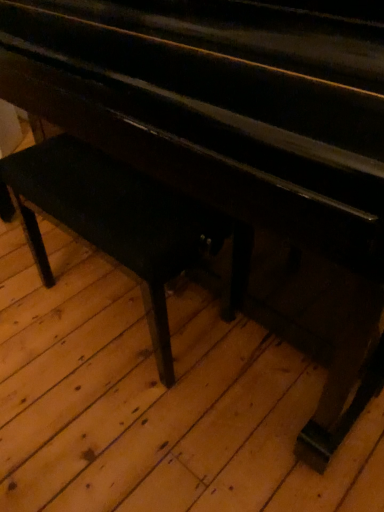
In order to click on free point above black matte bench at lower left (from a real-world perspective) in this screenshot , I will do point(103,174).